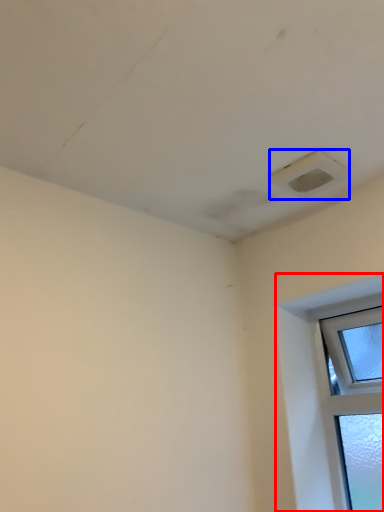
Question: Among these objects, which one is farthest to the camera, window (highlighted by a red box) or air conditioning (highlighted by a blue box)?

Choices:
 (A) window
 (B) air conditioning

Answer: (A)